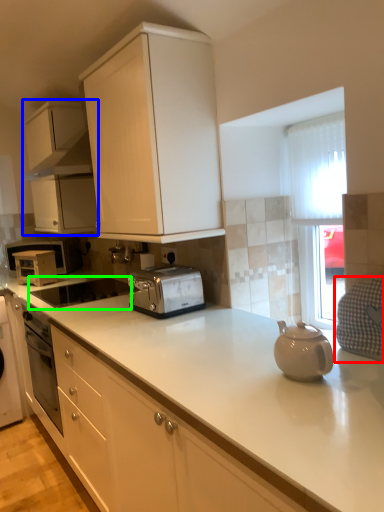
Question: Considering the real-world distances, which object is farthest from gray (highlighted by a red box)? cabinetry (highlighted by a blue box) or appliance (highlighted by a green box)?

Choices:
 (A) cabinetry
 (B) appliance

Answer: (A)